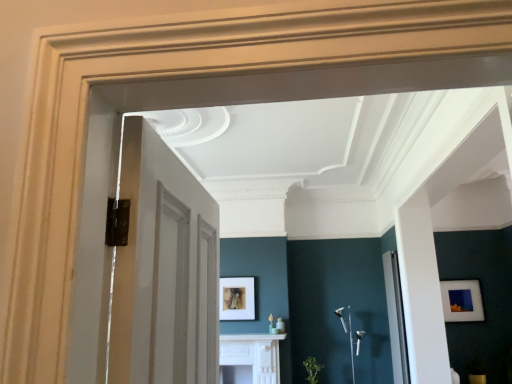
Question: Which direction should I rotate to look at matte gold picture frame at center, which ranks as the 2th picture frame in right-to-left order, — up or down?

Choices:
 (A) up
 (B) down

Answer: (B)

Question: Does clear glass door at right have a larger size compared to matte white picture frame at right, which is the second picture frame from left to right?

Choices:
 (A) yes
 (B) no

Answer: (A)

Question: Is clear glass door at right to the right of matte white picture frame at right, which is the second picture frame from left to right, from the viewer's perspective?

Choices:
 (A) yes
 (B) no

Answer: (B)

Question: Would you say clear glass door at right contains matte white picture frame at right, positioned as the first picture frame in right-to-left order?

Choices:
 (A) yes
 (B) no

Answer: (B)

Question: Is clear glass door at right shorter than matte white picture frame at right, positioned as the first picture frame in right-to-left order?

Choices:
 (A) yes
 (B) no

Answer: (B)

Question: Is clear glass door at right positioned in front of matte white picture frame at right, which is the second picture frame from left to right?

Choices:
 (A) no
 (B) yes

Answer: (B)

Question: From a real-world perspective, is clear glass door at right under matte white picture frame at right, positioned as the first picture frame in right-to-left order?

Choices:
 (A) yes
 (B) no

Answer: (A)

Question: Is matte gold picture frame at center, the first picture frame viewed from the left, further to camera compared to matte white picture frame at right, which is the second picture frame from left to right?

Choices:
 (A) yes
 (B) no

Answer: (B)

Question: Considering the relative sizes of matte gold picture frame at center, the first picture frame viewed from the left, and matte white picture frame at right, which is the second picture frame from left to right, in the image provided, is matte gold picture frame at center, the first picture frame viewed from the left, shorter than matte white picture frame at right, which is the second picture frame from left to right,?

Choices:
 (A) no
 (B) yes

Answer: (B)

Question: Is matte gold picture frame at center, which ranks as the 2th picture frame in right-to-left order, wider than matte white picture frame at right, which is the second picture frame from left to right?

Choices:
 (A) yes
 (B) no

Answer: (A)

Question: Considering the relative sizes of matte gold picture frame at center, which ranks as the 2th picture frame in right-to-left order, and matte white picture frame at right, positioned as the first picture frame in right-to-left order, in the image provided, is matte gold picture frame at center, which ranks as the 2th picture frame in right-to-left order, bigger than matte white picture frame at right, positioned as the first picture frame in right-to-left order,?

Choices:
 (A) yes
 (B) no

Answer: (B)

Question: From a real-world perspective, is matte gold picture frame at center, which ranks as the 2th picture frame in right-to-left order, physically above matte white picture frame at right, which is the second picture frame from left to right?

Choices:
 (A) no
 (B) yes

Answer: (B)

Question: Is there a large distance between matte gold picture frame at center, which ranks as the 2th picture frame in right-to-left order, and matte white picture frame at right, which is the second picture frame from left to right?

Choices:
 (A) yes
 (B) no

Answer: (A)

Question: From the image's perspective, is white glossy fireplace at center located beneath matte white picture frame at right, which is the second picture frame from left to right?

Choices:
 (A) yes
 (B) no

Answer: (A)